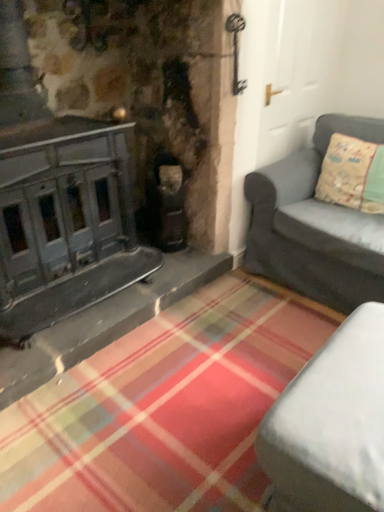
Question: Does white fabric studio couch at lower right, marked as the 1th studio couch in a bottom-to-top arrangement, appear on the right side of light green fabric pillow at right?

Choices:
 (A) no
 (B) yes

Answer: (A)

Question: Can you confirm if white fabric studio couch at lower right, marked as the 1th studio couch in a bottom-to-top arrangement, is thinner than light green fabric pillow at right?

Choices:
 (A) no
 (B) yes

Answer: (A)

Question: Can we say white fabric studio couch at lower right, which appears as the second studio couch when viewed from the back, lies outside light green fabric pillow at right?

Choices:
 (A) yes
 (B) no

Answer: (A)

Question: Is white fabric studio couch at lower right, which appears as the second studio couch when viewed from the back, far away from light green fabric pillow at right?

Choices:
 (A) yes
 (B) no

Answer: (A)

Question: From the image's perspective, is white fabric studio couch at lower right, marked as the 1th studio couch in a bottom-to-top arrangement, on light green fabric pillow at right?

Choices:
 (A) no
 (B) yes

Answer: (A)

Question: From a real-world perspective, is white fabric studio couch at lower right, which is counted as the second studio couch, starting from the top, over light green fabric pillow at right?

Choices:
 (A) yes
 (B) no

Answer: (B)

Question: Is matte gray couch at right, which is the second studio couch in front-to-back order, positioned with its back to light green fabric pillow at right?

Choices:
 (A) yes
 (B) no

Answer: (A)

Question: Does matte gray couch at right, placed as the first studio couch when sorted from top to bottom, have a larger size compared to light green fabric pillow at right?

Choices:
 (A) no
 (B) yes

Answer: (B)

Question: From the image's perspective, is matte gray couch at right, the 1th studio couch when ordered from back to front, located above light green fabric pillow at right?

Choices:
 (A) yes
 (B) no

Answer: (B)

Question: Is matte gray couch at right, placed as the first studio couch when sorted from top to bottom, surrounding light green fabric pillow at right?

Choices:
 (A) no
 (B) yes

Answer: (B)

Question: Does matte gray couch at right, which is the second studio couch in front-to-back order, have a lesser height compared to light green fabric pillow at right?

Choices:
 (A) no
 (B) yes

Answer: (A)

Question: Does matte gray couch at right, placed as the first studio couch when sorted from top to bottom, appear on the right side of light green fabric pillow at right?

Choices:
 (A) no
 (B) yes

Answer: (A)

Question: Can you confirm if matte gray couch at right, the 1th studio couch when ordered from back to front, is smaller than white fabric studio couch at lower right, which is counted as the second studio couch, starting from the top?

Choices:
 (A) yes
 (B) no

Answer: (B)